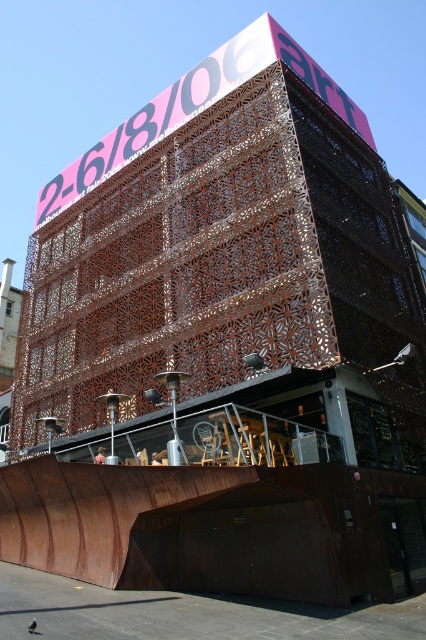
Question: Among these objects, which one is nearest to the camera?

Choices:
 (A) metallic skateboard at center
 (B) rusty metal ramp at lower center

Answer: (B)

Question: In this image, where is rusty metal ramp at lower center located relative to metallic skateboard at center?

Choices:
 (A) right
 (B) left

Answer: (A)

Question: Is rusty metal ramp at lower center smaller than metallic skateboard at center?

Choices:
 (A) yes
 (B) no

Answer: (B)

Question: Is rusty metal ramp at lower center closer to camera compared to metallic skateboard at center?

Choices:
 (A) no
 (B) yes

Answer: (B)

Question: Which point is farther to the camera?

Choices:
 (A) (103, 456)
 (B) (164, 506)

Answer: (A)

Question: Which point is closer to the camera taking this photo?

Choices:
 (A) (108, 472)
 (B) (100, 452)

Answer: (A)